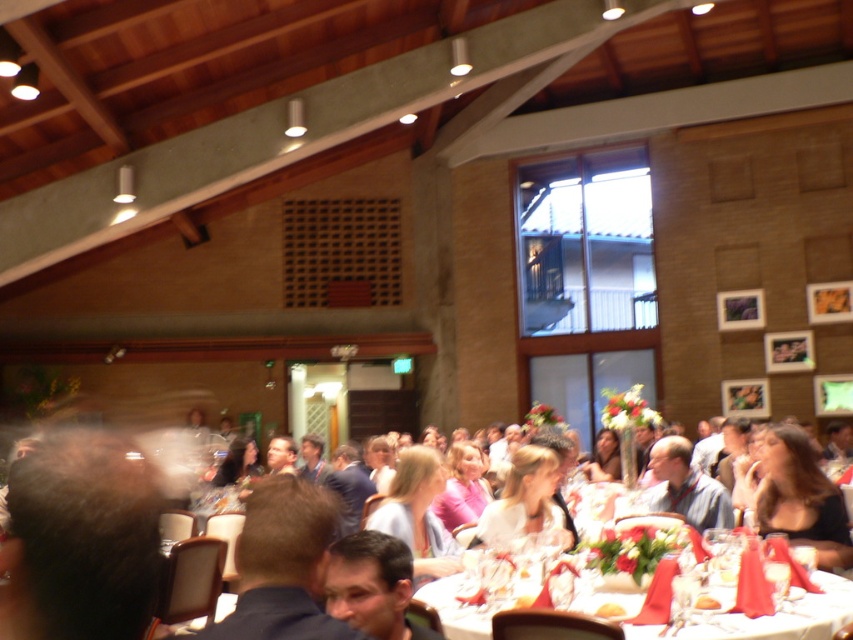
Can you confirm if yellow cake at center is smaller than white glossy bread at lower right?

Actually, yellow cake at center might be larger than white glossy bread at lower right.

Between yellow cake at center and white glossy bread at lower right, which one is positioned lower?

yellow cake at center is lower down.

Is point (608, 609) positioned behind point (720, 604)?

No, it is in front of (720, 604).

Locate an element on the screen. yellow cake at center is located at coordinates (610, 611).

Is white tablecloth at center smaller than white glossy bread at lower right?

No, white tablecloth at center is not smaller than white glossy bread at lower right.

Does white tablecloth at center have a lesser width compared to white glossy bread at lower right?

No, white tablecloth at center is not thinner than white glossy bread at lower right.

Is point (837, 579) positioned before point (701, 595)?

No, (837, 579) is further to viewer.

The width and height of the screenshot is (853, 640). I want to click on white tablecloth at center, so (785, 616).

Can you confirm if white tablecloth at center is smaller than yellow cake at center?

No, white tablecloth at center is not smaller than yellow cake at center.

Is the position of white tablecloth at center more distant than that of yellow cake at center?

No, it is in front of yellow cake at center.

Find the location of `white tablecloth at center`. white tablecloth at center is located at coordinates (785, 616).

Image resolution: width=853 pixels, height=640 pixels. What are the coordinates of `white tablecloth at center` in the screenshot? It's located at (785, 616).